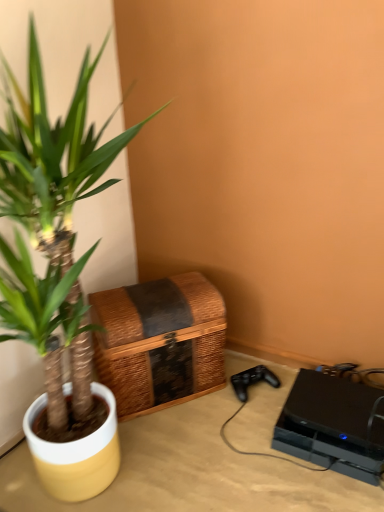
Measure the distance between point (x=148, y=326) and camera.

Point (x=148, y=326) and camera are 1.21 meters apart from each other.

The width and height of the screenshot is (384, 512). What do you see at coordinates (57, 208) in the screenshot?
I see `green leafy plant at left` at bounding box center [57, 208].

Identify the location of woven brown basket at lower left. This screenshot has height=512, width=384. (160, 341).

From the image's perspective, does woven brown basket at lower left appear higher than black matte gaming console at lower right?

Yes, from the image's perspective, woven brown basket at lower left is over black matte gaming console at lower right.

Is woven brown basket at lower left smaller than black matte gaming console at lower right?

Actually, woven brown basket at lower left might be larger than black matte gaming console at lower right.

In the scene shown: From a real-world perspective, which is physically above, woven brown basket at lower left or black matte gaming console at lower right?

In real-world perspective, woven brown basket at lower left is above.

Is black matte gaming console at lower right surrounded by woven brown basket at lower left?

No, woven brown basket at lower left does not contain black matte gaming console at lower right.

From the picture: Who is more distant, green leafy plant at left or woven brown basket at lower left?

Positioned behind is woven brown basket at lower left.

Is green leafy plant at left positioned beyond the bounds of woven brown basket at lower left?

Indeed, green leafy plant at left is completely outside woven brown basket at lower left.

Considering the relative sizes of green leafy plant at left and woven brown basket at lower left in the image provided, is green leafy plant at left thinner than woven brown basket at lower left?

No, green leafy plant at left is not thinner than woven brown basket at lower left.

Between green leafy plant at left and woven brown basket at lower left, which one has more height?

green leafy plant at left.

Considering the positions of points (78, 401) and (256, 466), is point (78, 401) closer to camera compared to point (256, 466)?

Yes, point (78, 401) is closer to viewer.

The image size is (384, 512). Identify the location of table behind the green leafy plant at left. (192, 469).

Are green leafy plant at left and beige wood table at lower right far apart?

No, green leafy plant at left is not far from beige wood table at lower right.

Does green leafy plant at left appear on the right side of beige wood table at lower right?

No, green leafy plant at left is not to the right of beige wood table at lower right.

From the image's perspective, is beige wood table at lower right above or below green leafy plant at left?

beige wood table at lower right is situated lower than green leafy plant at left in the image.

From their relative heights in the image, would you say beige wood table at lower right is taller or shorter than green leafy plant at left?

In the image, beige wood table at lower right appears to be shorter than green leafy plant at left.

Does beige wood table at lower right turn towards green leafy plant at left?

No, beige wood table at lower right does not turn towards green leafy plant at left.

Does beige wood table at lower right have a greater height compared to woven brown basket at lower left?

No.

What are the coordinates of `basket that appears on the left of beige wood table at lower right` in the screenshot? It's located at (160, 341).

Could you tell me if beige wood table at lower right is turned towards woven brown basket at lower left?

No, beige wood table at lower right is not turned towards woven brown basket at lower left.

From the image's perspective, is beige wood table at lower right located above woven brown basket at lower left?

Actually, beige wood table at lower right appears below woven brown basket at lower left in the image.

Is woven brown basket at lower left inside or outside of green leafy plant at left?

The correct answer is: outside.

Could you tell me if woven brown basket at lower left is turned towards green leafy plant at left?

Yes, woven brown basket at lower left is facing green leafy plant at left.

Considering the relative sizes of woven brown basket at lower left and green leafy plant at left in the image provided, is woven brown basket at lower left shorter than green leafy plant at left?

Indeed, woven brown basket at lower left has a lesser height compared to green leafy plant at left.

Is woven brown basket at lower left positioned far away from green leafy plant at left?

woven brown basket at lower left is actually quite close to green leafy plant at left.

Is beige wood table at lower right facing towards black matte gaming console at lower right?

No, beige wood table at lower right is not oriented towards black matte gaming console at lower right.

Is beige wood table at lower right positioned far away from black matte gaming console at lower right?

That's not correct — beige wood table at lower right is a little close to black matte gaming console at lower right.

Would you say beige wood table at lower right contains black matte gaming console at lower right?

No, black matte gaming console at lower right is located outside of beige wood table at lower right.

Can you confirm if beige wood table at lower right is thinner than black matte gaming console at lower right?

In fact, beige wood table at lower right might be wider than black matte gaming console at lower right.

At what (x,y) coordinates should I click in order to perform the action: click on basket that appears above the black matte gaming console at lower right (from a real-world perspective). Please return your answer as a coordinate pair (x, y). This screenshot has width=384, height=512. Looking at the image, I should click on (160, 341).

You are a GUI agent. You are given a task and a screenshot of the screen. Output one action in this format:
    pyautogui.click(x=<x>, y=<y>)
    Task: Click on the houseplant above the woven brown basket at lower left (from the image's perspective)
    
    Given the screenshot: What is the action you would take?
    pyautogui.click(x=57, y=208)

Based on their spatial positions, is beige wood table at lower right or black matte gaming console at lower right closer to woven brown basket at lower left?

A: beige wood table at lower right is closer to woven brown basket at lower left.

When comparing their distances from black matte gaming console at lower right, does green leafy plant at left or woven brown basket at lower left seem further?

green leafy plant at left.

Estimate the real-world distances between objects in this image. Which object is further from woven brown basket at lower left, beige wood table at lower right or green leafy plant at left?

green leafy plant at left.

Which object lies nearer to the anchor point beige wood table at lower right, green leafy plant at left or black matte gaming console at lower right?

black matte gaming console at lower right is positioned closer to the anchor beige wood table at lower right.

When comparing their distances from beige wood table at lower right, does green leafy plant at left or woven brown basket at lower left seem further?

Based on the image, green leafy plant at left appears to be further to beige wood table at lower right.

Looking at the image, which one is located further to woven brown basket at lower left, green leafy plant at left or beige wood table at lower right?

Among the two, green leafy plant at left is located further to woven brown basket at lower left.

From the picture: Estimate the real-world distances between objects in this image. Which object is closer to green leafy plant at left, black matte gaming console at lower right or beige wood table at lower right?

beige wood table at lower right lies closer to green leafy plant at left than the other object.

When comparing their distances from black matte gaming console at lower right, does woven brown basket at lower left or beige wood table at lower right seem closer?

beige wood table at lower right lies closer to black matte gaming console at lower right than the other object.

Where is `table between green leafy plant at left and woven brown basket at lower left in the front-back direction`? table between green leafy plant at left and woven brown basket at lower left in the front-back direction is located at coordinates (192, 469).

The image size is (384, 512). Find the location of `table located between woven brown basket at lower left and black matte gaming console at lower right in the left-right direction`. table located between woven brown basket at lower left and black matte gaming console at lower right in the left-right direction is located at coordinates (192, 469).

You are a GUI agent. You are given a task and a screenshot of the screen. Output one action in this format:
    pyautogui.click(x=<x>, y=<y>)
    Task: Click on the computer positioned between green leafy plant at left and woven brown basket at lower left from near to far
    
    Given the screenshot: What is the action you would take?
    pyautogui.click(x=332, y=426)

Identify the location of table between green leafy plant at left and black matte gaming console at lower right along the z-axis. The height and width of the screenshot is (512, 384). (192, 469).